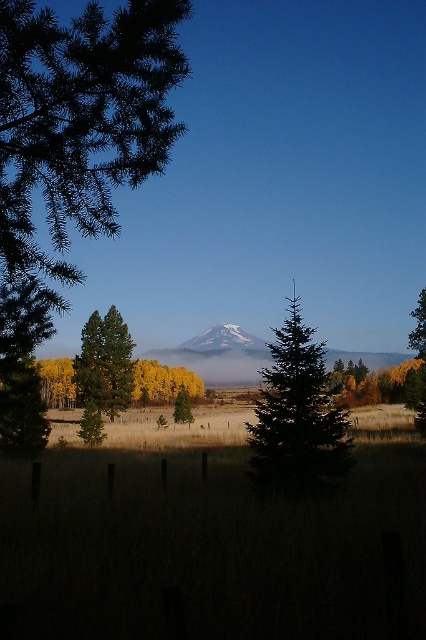
Can you confirm if green matte tree at left is positioned to the right of green matte tree at center?

In fact, green matte tree at left is to the left of green matte tree at center.

Does point (115, 12) come in front of point (180, 406)?

Yes, it is.

Identify the location of green matte tree at left. The image size is (426, 640). (71, 161).

Who is taller, green textured pine tree at left or white snow-covered mountain at center?

With more height is green textured pine tree at left.

Based on the photo, does green textured pine tree at left have a lesser width compared to white snow-covered mountain at center?

In fact, green textured pine tree at left might be wider than white snow-covered mountain at center.

Is point (23, 362) farther from camera compared to point (213, 342)?

That is False.

The height and width of the screenshot is (640, 426). Identify the location of green textured pine tree at left. (23, 364).

Is the position of green textured pine tree at left more distant than that of green matte tree at center?

No, green textured pine tree at left is in front of green matte tree at center.

What do you see at coordinates (23, 364) in the screenshot? This screenshot has width=426, height=640. I see `green textured pine tree at left` at bounding box center [23, 364].

Between point (48, 432) and point (178, 410), which one is positioned in front?

Positioned in front is point (48, 432).

Find the location of `green textured pine tree at left`. green textured pine tree at left is located at coordinates (23, 364).